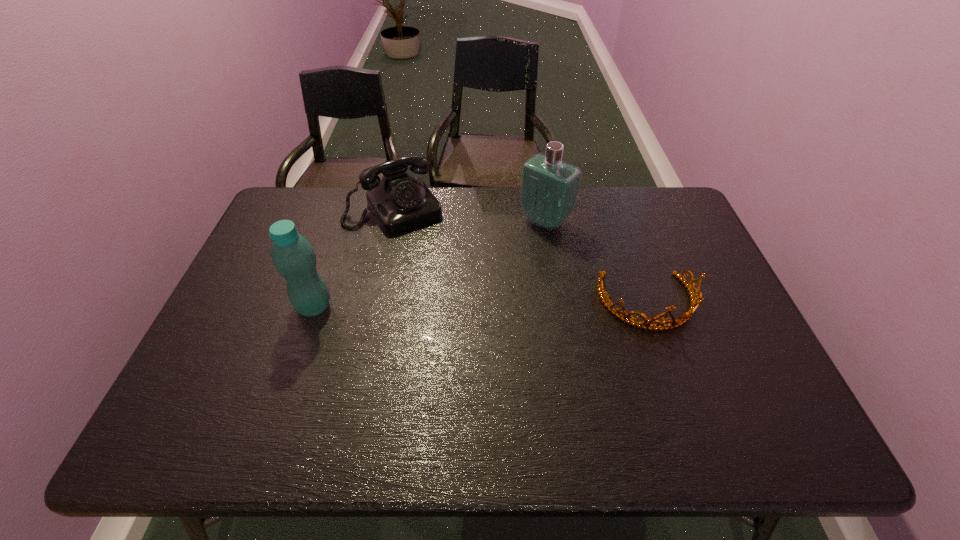
Where is `free space between the third object from left to right and the telephone`? The height and width of the screenshot is (540, 960). free space between the third object from left to right and the telephone is located at coordinates (469, 215).

This screenshot has height=540, width=960. Identify the location of empty space that is in between the shortest object and the second object from right to left. (596, 262).

In order to click on vacant point located between the perfume and the tiara in this screenshot , I will do `click(596, 262)`.

What are the coordinates of `vacant region between the telephone and the rightmost object` in the screenshot? It's located at (521, 256).

Locate an element on the screen. The image size is (960, 540). unoccupied area between the second shortest object and the perfume is located at coordinates (469, 215).

Locate an element on the screen. Image resolution: width=960 pixels, height=540 pixels. object that is the second closest to the water bottle is located at coordinates (549, 188).

Identify the location of object that can be found as the third closest to the water bottle. This screenshot has width=960, height=540. (695, 300).